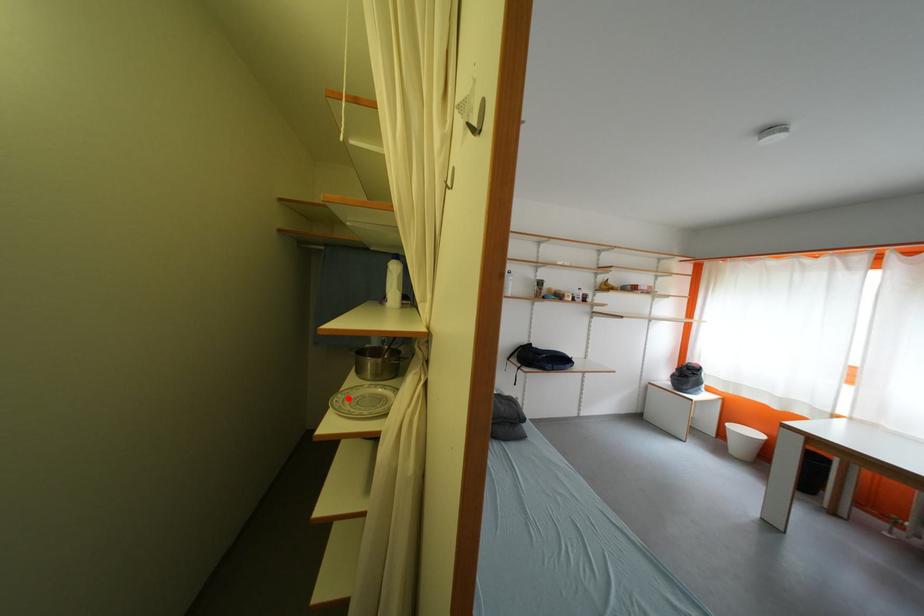
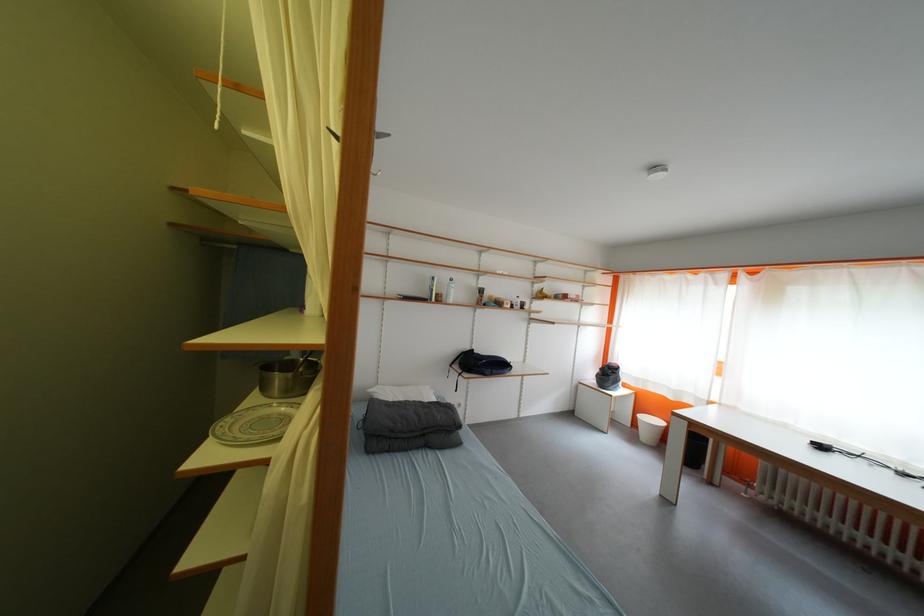
In the second image, find the point that corresponds to the highlighted location in the first image.

(237, 422)